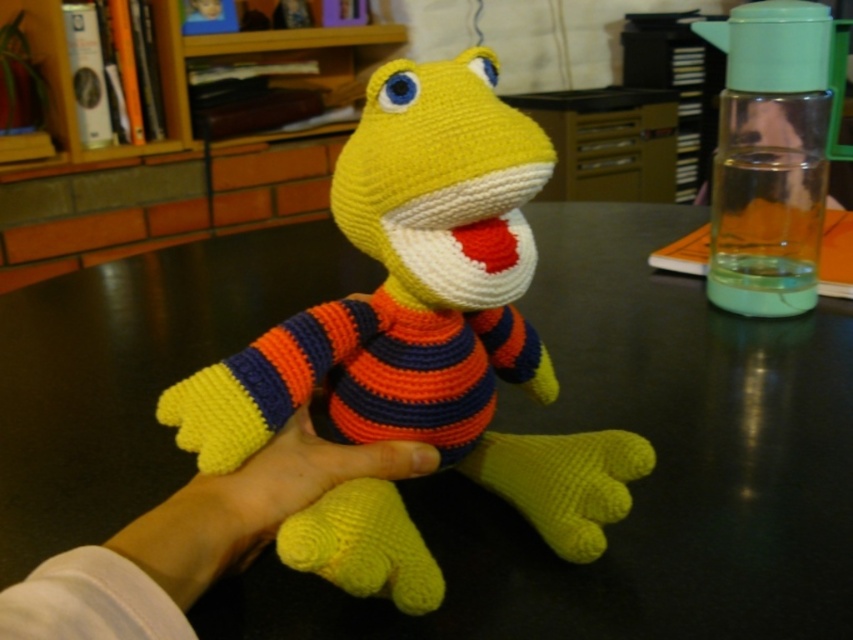
Question: Considering the relative positions of black glossy table at center and yellow yarn hand at center in the image provided, where is black glossy table at center located with respect to yellow yarn hand at center?

Choices:
 (A) left
 (B) right

Answer: (B)

Question: Can you confirm if black glossy table at center is thinner than yellow yarn toy at center?

Choices:
 (A) no
 (B) yes

Answer: (A)

Question: Which point is closer to the camera?

Choices:
 (A) yellow yarn toy at center
 (B) yellow yarn hand at center
 (C) yellow yarn at lower center

Answer: (B)

Question: Which object is the closest to the yellow yarn toy at center?

Choices:
 (A) black glossy table at center
 (B) yellow yarn at lower center

Answer: (B)

Question: Which object is the farthest from the yellow yarn hand at center?

Choices:
 (A) yellow yarn toy at center
 (B) yellow yarn at lower center

Answer: (A)

Question: Does black glossy table at center appear on the right side of yellow yarn hand at center?

Choices:
 (A) yes
 (B) no

Answer: (A)